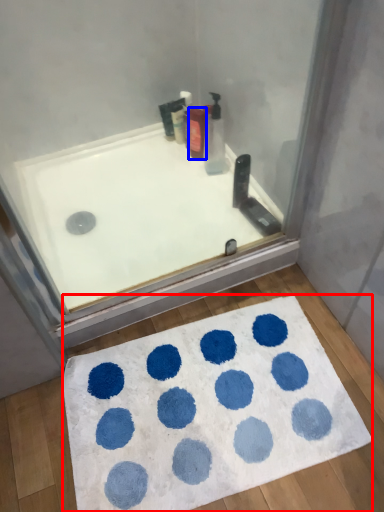
Question: Which object is further to the camera taking this photo, bath mat (highlighted by a red box) or toiletry (highlighted by a blue box)?

Choices:
 (A) bath mat
 (B) toiletry

Answer: (B)